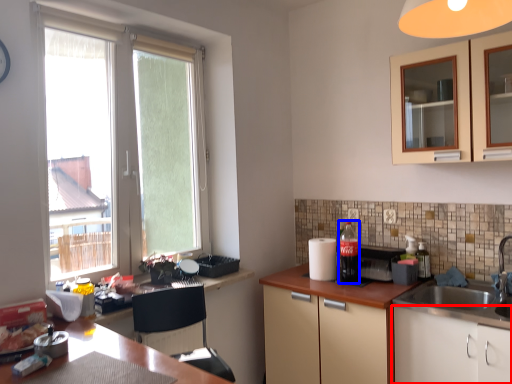
Question: Among these objects, which one is nearest to the camera, cabinetry (highlighted by a red box) or beverage (highlighted by a blue box)?

Choices:
 (A) cabinetry
 (B) beverage

Answer: (A)